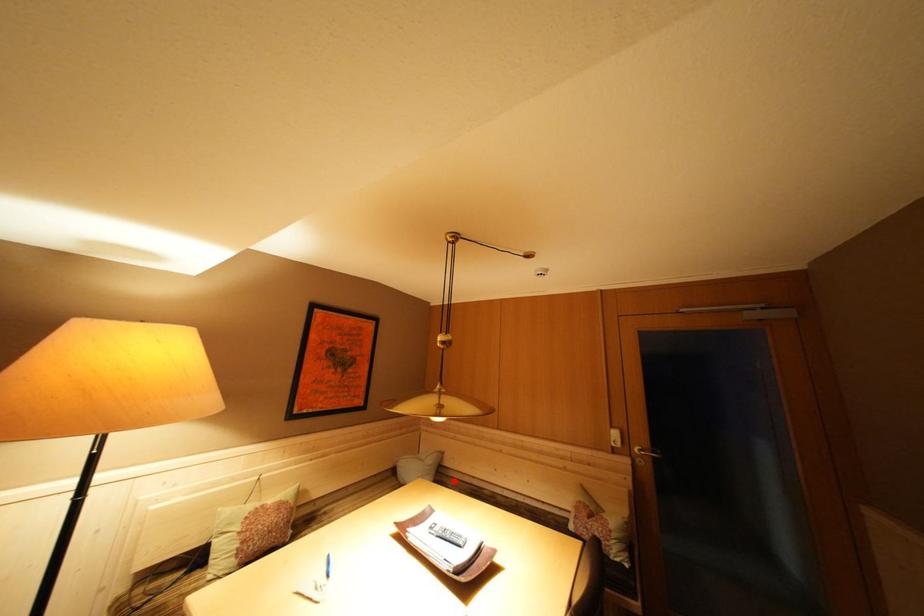
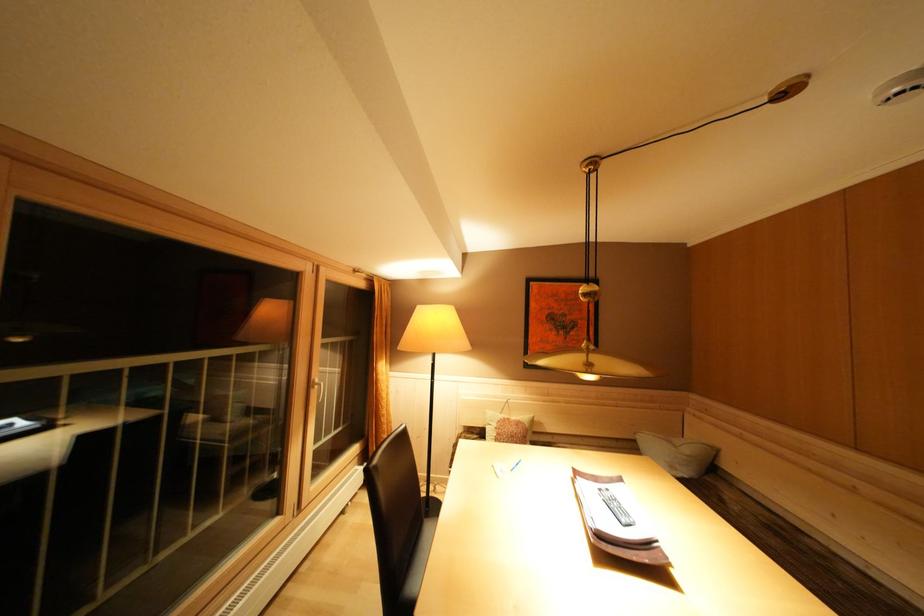
Question: I am providing you with two images of the same scene from different viewpoints. A red point is shown in image1. For the corresponding object point in image2, is it positioned nearer or farther from the camera?

Choices:
 (A) Nearer
 (B) Farther

Answer: (A)